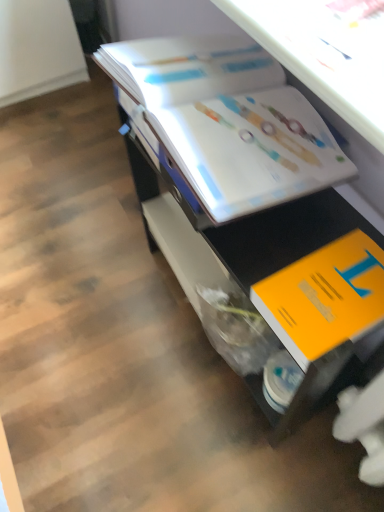
Identify the location of vacant space positioned to the left of white glossy book at upper center. Image resolution: width=384 pixels, height=512 pixels. (97, 329).